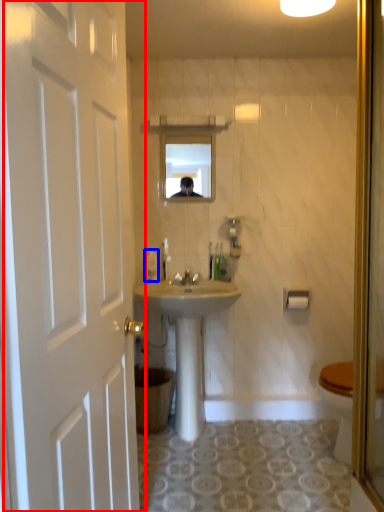
Question: Which point is further to the camera, door (highlighted by a red box) or toiletries (highlighted by a blue box)?

Choices:
 (A) door
 (B) toiletries

Answer: (B)